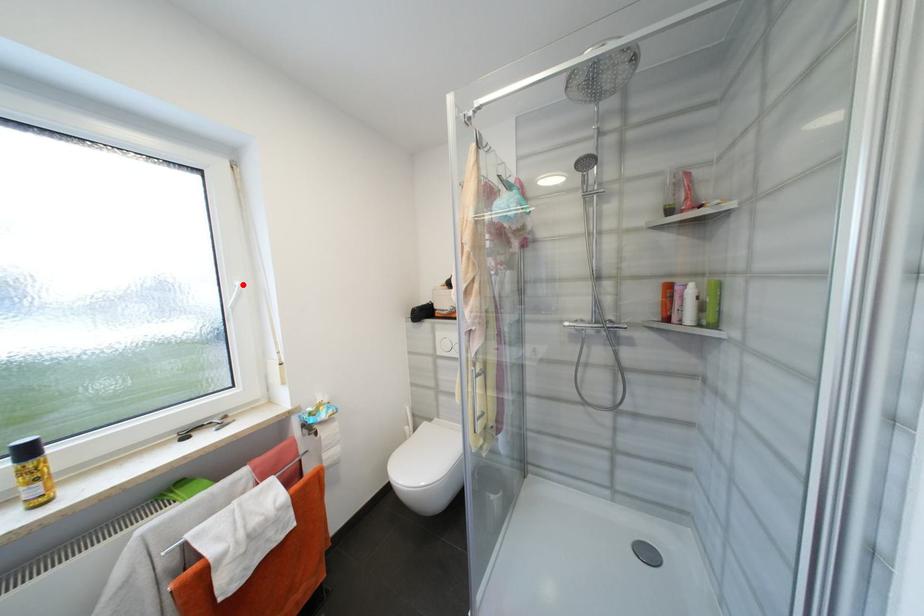
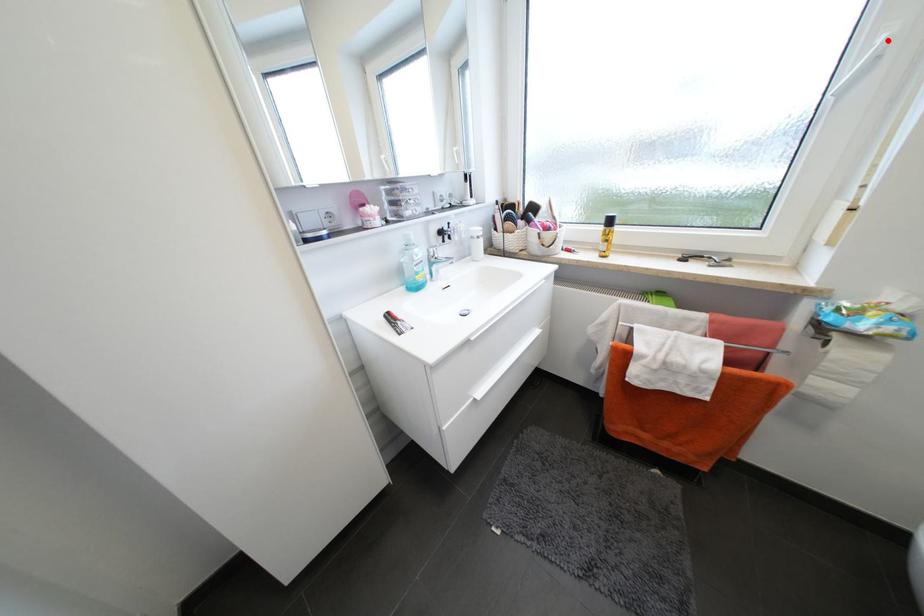
I am providing you with two images of the same scene from different viewpoints. A red point is marked on the first image and another point is marked on the second image. Does the point marked in image1 correspond to the same location as the one in image2?

Yes